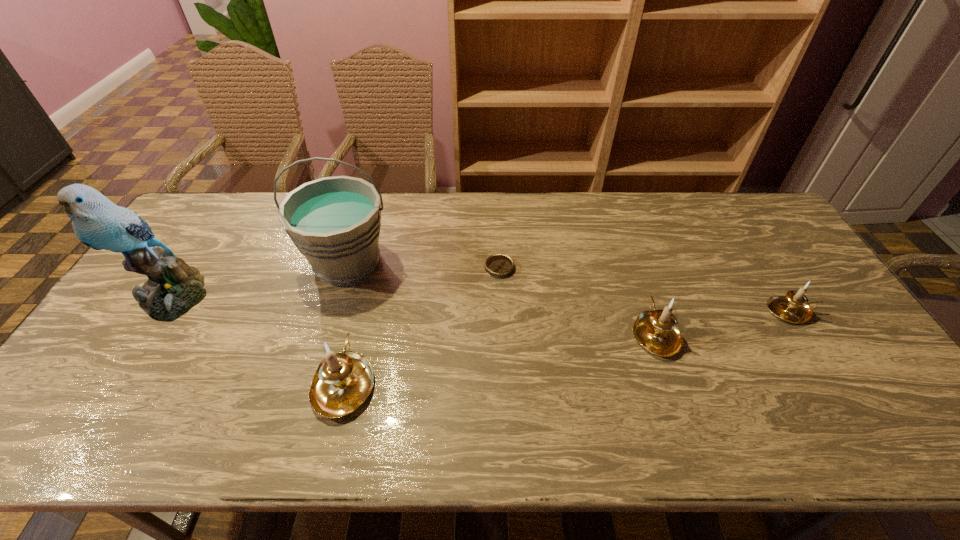
At what (x,y) coordinates should I click in order to perform the action: click on the tallest candle holder. Please return your answer as a coordinate pair (x, y). Looking at the image, I should click on (343, 381).

Locate an element on the screen. the fourth shortest object is located at coordinates (343, 381).

Locate an element on the screen. Image resolution: width=960 pixels, height=540 pixels. the second tallest candle holder is located at coordinates (656, 330).

Locate an element on the screen. the fifth object from left to right is located at coordinates (656, 330).

Locate an element on the screen. The image size is (960, 540). the rightmost object is located at coordinates (794, 307).

The image size is (960, 540). I want to click on the fifth tallest object, so [x=794, y=307].

In order to click on parakeet in this screenshot , I will do `click(173, 288)`.

The height and width of the screenshot is (540, 960). In order to click on bucket in this screenshot , I will do `click(335, 222)`.

The height and width of the screenshot is (540, 960). In order to click on compass in this screenshot , I will do `click(498, 265)`.

Image resolution: width=960 pixels, height=540 pixels. Find the location of `the shortest object`. the shortest object is located at coordinates (498, 265).